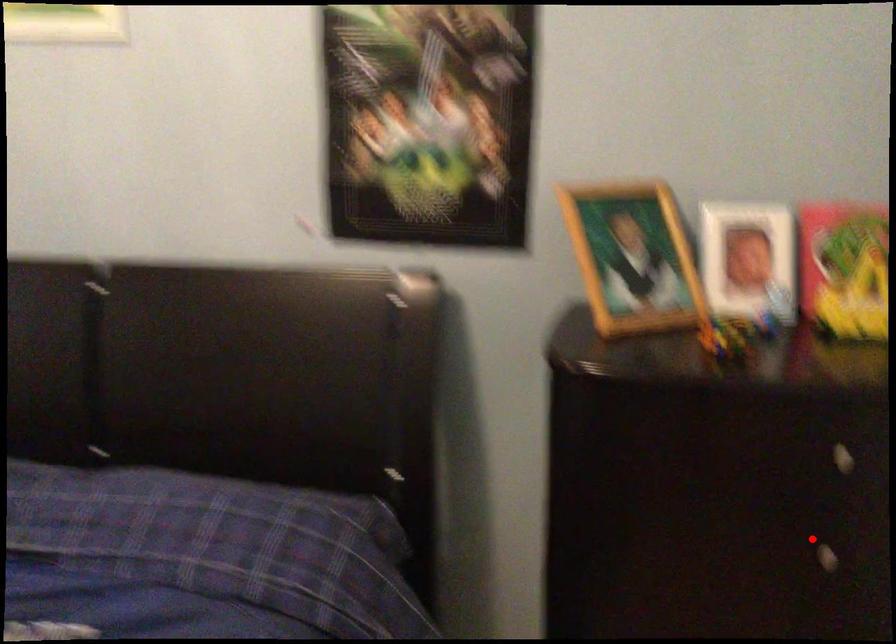
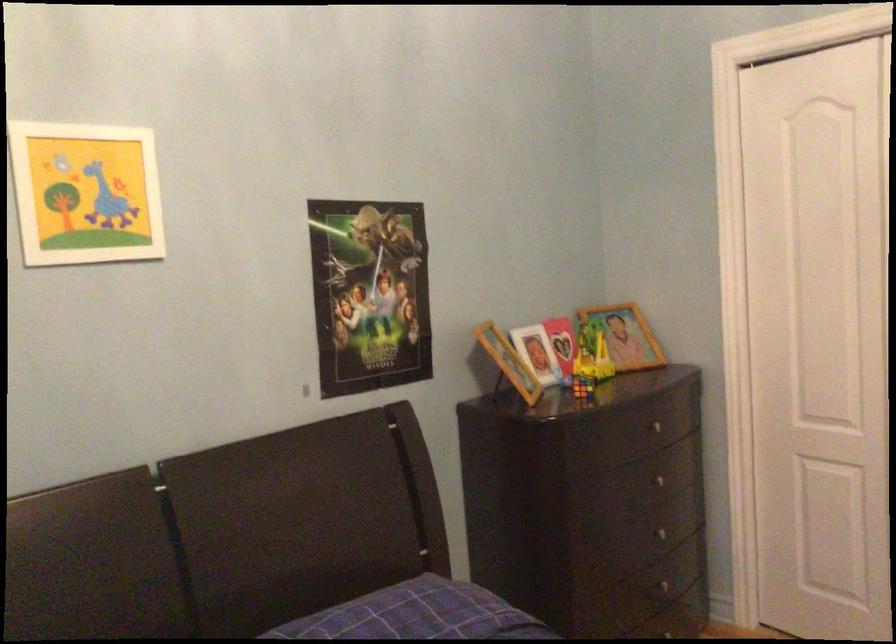
Question: A red point is marked in image1. In image2, is the corresponding 3D point closer to the camera or farther? Reply with the corresponding letter.

Choices:
 (A) The corresponding 3D point is closer.
 (B) The corresponding 3D point is farther.

Answer: (B)